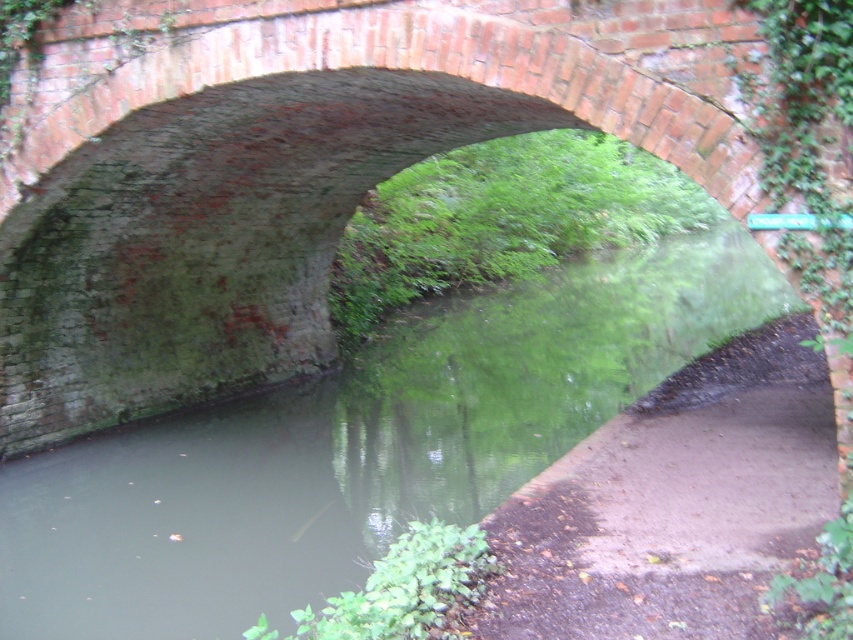
Which is more to the right, brick archway at center or green mossy river at center?

green mossy river at center is more to the right.

Is brick archway at center to the right of green mossy river at center from the viewer's perspective?

In fact, brick archway at center is to the left of green mossy river at center.

In order to click on brick archway at center in this screenshot , I will do [291, 170].

Where is `brick archway at center`? brick archway at center is located at coordinates (291, 170).